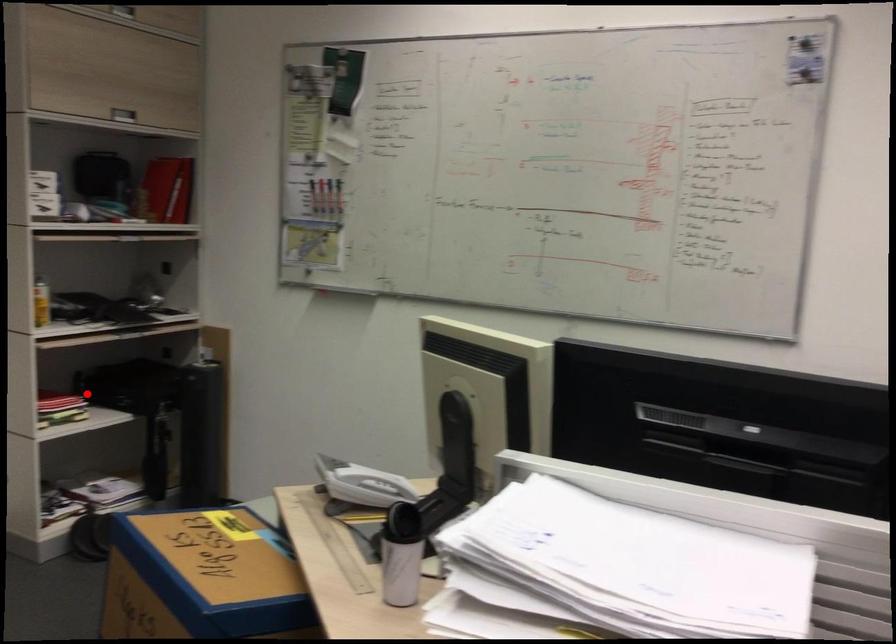
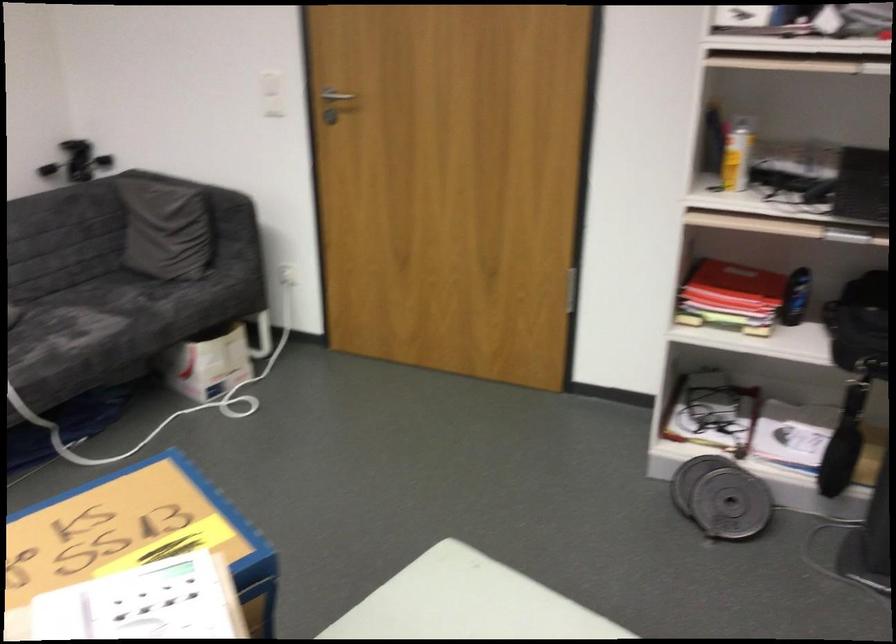
Find the pixel in the second image that matches the highlighted location in the first image.

(796, 297)